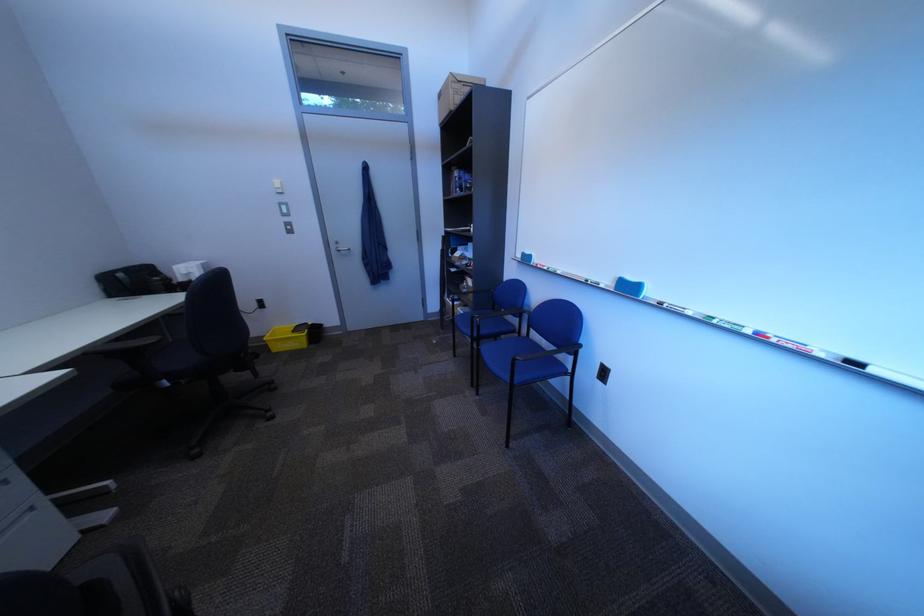
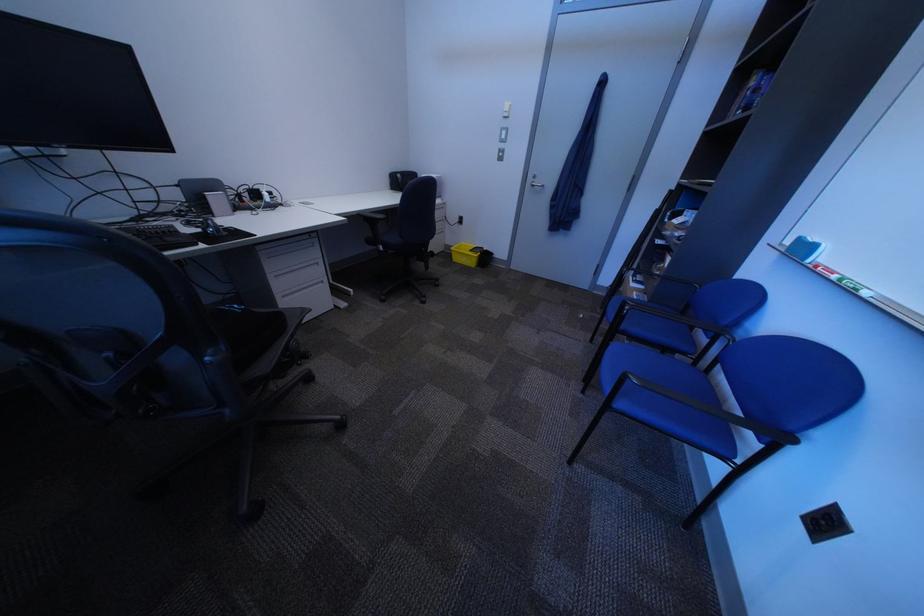
Locate, in the second image, the point that corresponds to [292,350] in the first image.

(470, 261)